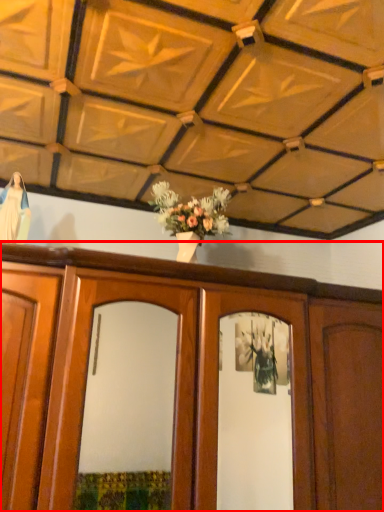
Question: From the image's perspective, considering the relative positions of cabinetry (annotated by the red box) and robe in the image provided, where is cabinetry (annotated by the red box) located with respect to the staircase?

Choices:
 (A) above
 (B) below

Answer: (B)